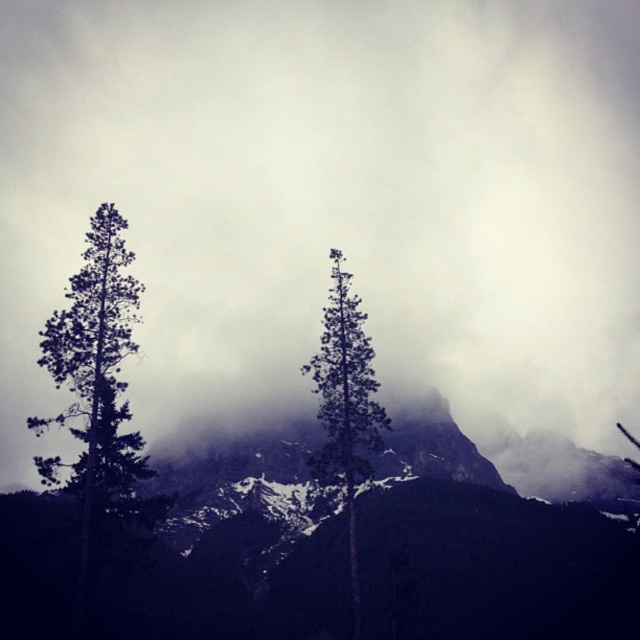
You are a hiker who wants to take a photo of the smokey gray rock at center and the green matte tree at center. Which object should you focus on first if you want to capture both in the same frame?

The smokey gray rock at center is located below the green matte tree at center, so you should focus on the green matte tree at center first to ensure both are in the same frame.

You are a hiker trying to navigate through the rugged mountain landscape in the image. You see two points marked on your map. One is at point (426, 483) and the other at point (67, 481). Which point is closer to the snow capped peaks in the background?

Point (426, 483) is behind point (67, 481). Since the snow capped peaks are in the background, the point that is further back would be closer to them. Therefore, point (426, 483) is closer to the snow capped peaks in the background.

You are a hiker who wants to place a small flag on the highest point between the smokey gray rock at center and the green matte tree at center. Which object should you choose?

The smokey gray rock at center has a larger size compared to the green matte tree at center, so the smokey gray rock at center is taller and the highest point.